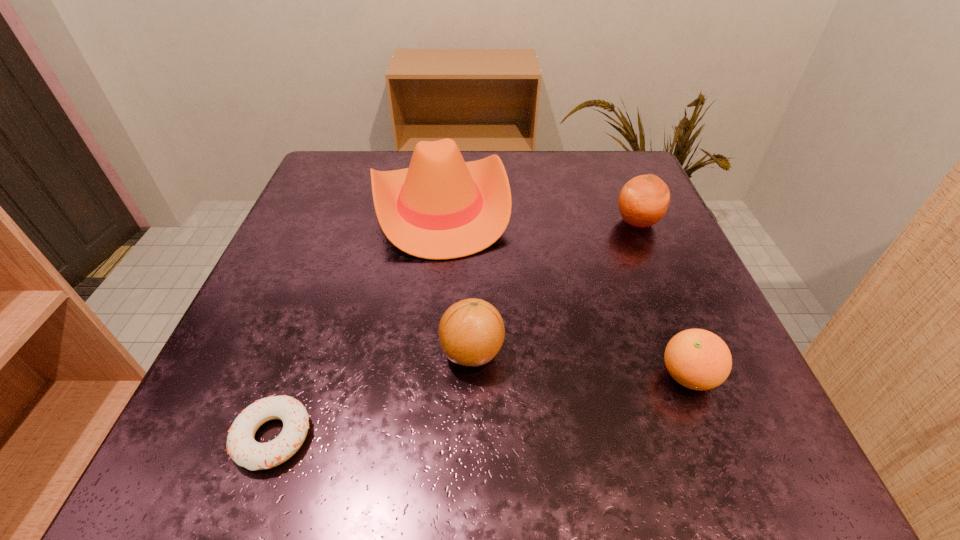
Image resolution: width=960 pixels, height=540 pixels. In the image, there is a desktop. What are the coordinates of `vacant space at the near edge` in the screenshot? It's located at (460, 472).

Locate an element on the screen. free space at the left edge is located at coordinates (340, 224).

Where is `free space at the right edge of the desktop`? Image resolution: width=960 pixels, height=540 pixels. free space at the right edge of the desktop is located at coordinates (654, 232).

Image resolution: width=960 pixels, height=540 pixels. What are the coordinates of `free space at the near left corner of the desktop` in the screenshot? It's located at (261, 476).

Locate an element on the screen. vacant space at the far right corner of the desktop is located at coordinates (611, 153).

Identify the location of unoccupied position between the farthest orange and the cowboy hat. (539, 214).

Find the location of a particular element. empty space between the farthest orange and the shortest orange is located at coordinates (662, 299).

Locate an element on the screen. unoccupied position between the second shortest object and the cowboy hat is located at coordinates (564, 292).

This screenshot has height=540, width=960. I want to click on free space between the cowboy hat and the farthest orange, so click(539, 214).

Identify the location of vacant point located between the shortest orange and the cowboy hat. Image resolution: width=960 pixels, height=540 pixels. (564, 292).